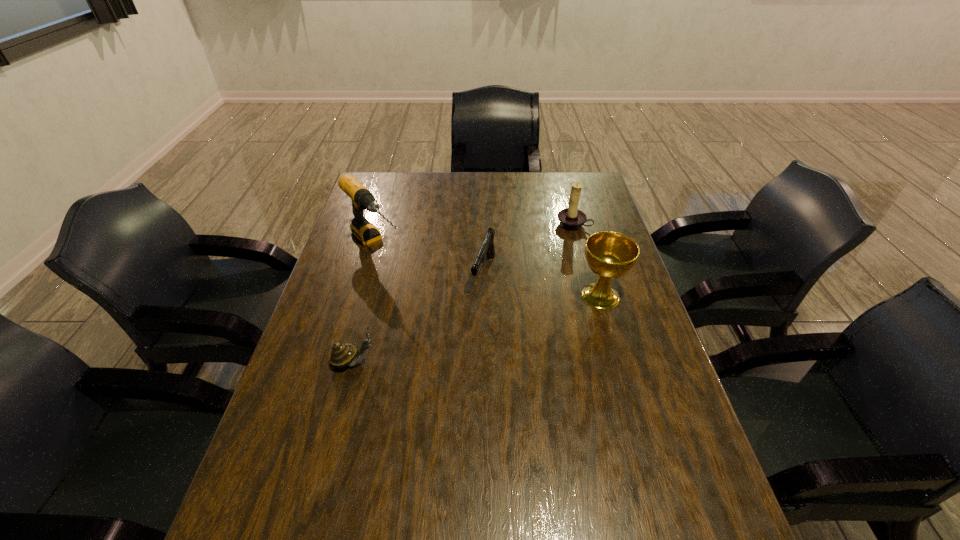
Where is `free space at the far edge`? free space at the far edge is located at coordinates (528, 201).

Where is `free space at the near edge of the desktop`? The width and height of the screenshot is (960, 540). free space at the near edge of the desktop is located at coordinates (446, 506).

The height and width of the screenshot is (540, 960). What are the coordinates of `vacant space at the left edge of the desktop` in the screenshot? It's located at point(303,407).

In the image, there is a desktop. Where is `vacant area at the right edge`? This screenshot has height=540, width=960. vacant area at the right edge is located at coordinates (606, 206).

In the image, there is a desktop. Where is `vacant space at the far left corner`? The image size is (960, 540). vacant space at the far left corner is located at coordinates (404, 183).

Locate an element on the screen. The image size is (960, 540). free region at the near right corner is located at coordinates (680, 487).

Where is `vacant space in between the candle holder and the nearest object`? vacant space in between the candle holder and the nearest object is located at coordinates (464, 293).

Locate an element on the screen. The image size is (960, 540). vacant space that is in between the nearest object and the candle holder is located at coordinates (464, 293).

Where is `free space between the drill and the chalice`? free space between the drill and the chalice is located at coordinates (488, 271).

I want to click on vacant area that lies between the gun and the drill, so point(429,259).